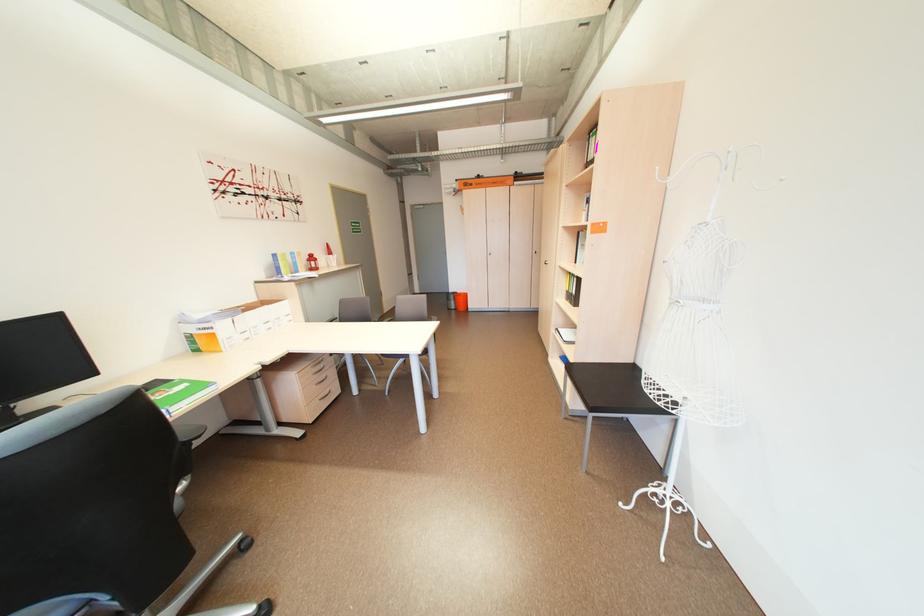
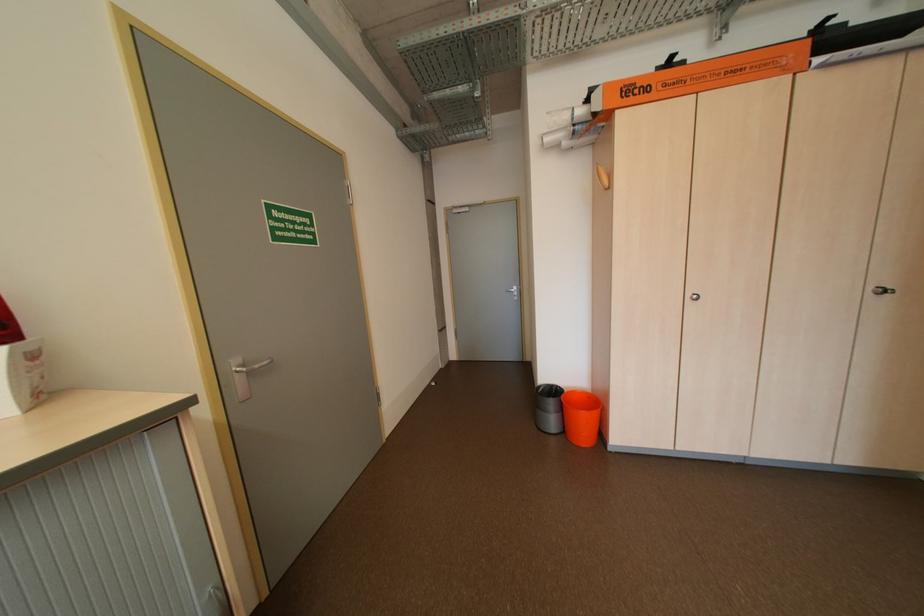
Find the pixel in the second image that matches [480,185] in the first image.

(655, 90)